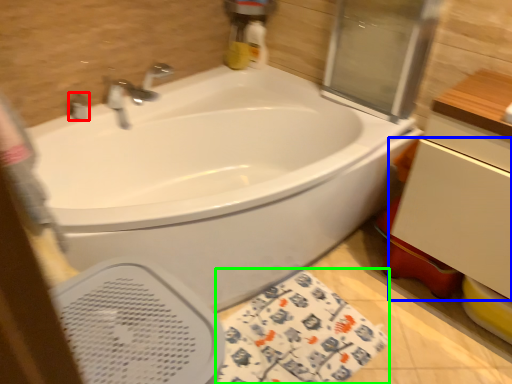
Question: Which object is positioned closest to plumbing fixture (highlighted by a red box)? Select from drawer (highlighted by a blue box) and beach towel (highlighted by a green box).

Choices:
 (A) drawer
 (B) beach towel

Answer: (B)